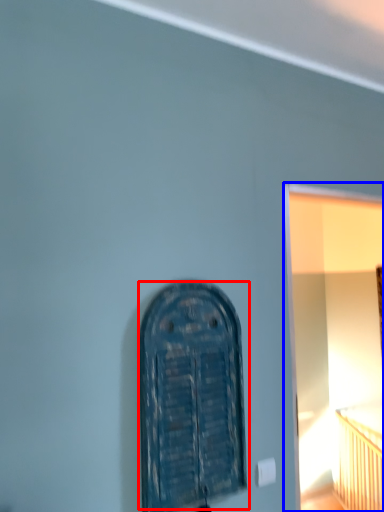
Question: Among these objects, which one is nearest to the camera, door (highlighted by a red box) or window frame (highlighted by a blue box)?

Choices:
 (A) door
 (B) window frame

Answer: (A)